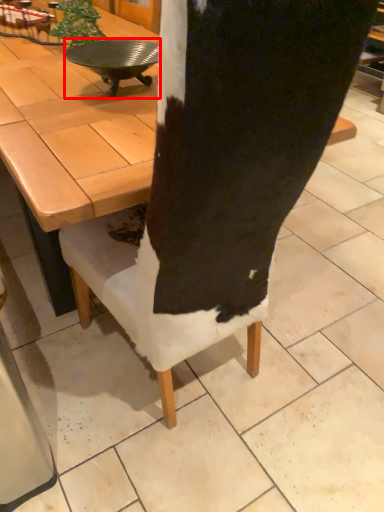
Question: Where is round table (annotated by the red box) located in relation to coffee table in the image?

Choices:
 (A) left
 (B) right

Answer: (B)